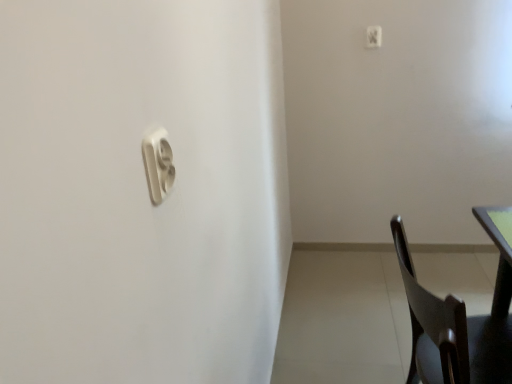
Locate an element on the screen. white plastic light switch at upper center, which is the first light switch from front to back is located at coordinates (x=158, y=165).

Identify the location of dark wood chair at lower right. This screenshot has height=384, width=512. (455, 329).

I want to click on table top below the white plastic light switch at upper center, which is the first light switch from front to back (from a real-world perspective), so click(495, 228).

Considering the positions of objects white plastic light switch at upper center, the first light switch positioned from the bottom, and green matte table top at right in the image provided, who is more to the left, white plastic light switch at upper center, the first light switch positioned from the bottom, or green matte table top at right?

Positioned to the left is white plastic light switch at upper center, the first light switch positioned from the bottom.

Between white plastic light switch at upper center, which appears as the second light switch when viewed from the right, and green matte table top at right, which one has smaller size?

With smaller size is white plastic light switch at upper center, which appears as the second light switch when viewed from the right.

Could you tell me if white plastic light switch at upper center, the 2th light switch positioned from the top, is turned towards green matte table top at right?

No, white plastic light switch at upper center, the 2th light switch positioned from the top, is not aimed at green matte table top at right.

Between white plastic light switch at upper right, which is counted as the first light switch, starting from the back, and dark wood chair at lower right, which one appears on the right side from the viewer's perspective?

dark wood chair at lower right.

From the image's perspective, between white plastic light switch at upper right, acting as the 2th light switch starting from the front, and dark wood chair at lower right, which one is located above?

white plastic light switch at upper right, acting as the 2th light switch starting from the front, appears higher in the image.

Considering their positions, is white plastic light switch at upper right, which ranks as the second light switch in left-to-right order, located in front of or behind dark wood chair at lower right?

Clearly, white plastic light switch at upper right, which ranks as the second light switch in left-to-right order, is behind dark wood chair at lower right.

Considering the sizes of white plastic light switch at upper right, which ranks as the second light switch in left-to-right order, and dark wood chair at lower right in the image, is white plastic light switch at upper right, which ranks as the second light switch in left-to-right order, taller or shorter than dark wood chair at lower right?

Clearly, white plastic light switch at upper right, which ranks as the second light switch in left-to-right order, is shorter compared to dark wood chair at lower right.

What's the angular difference between green matte table top at right and white plastic light switch at upper right, which ranks as the second light switch in left-to-right order,'s facing directions?

There is a 88.5-degree angle between the facing directions of green matte table top at right and white plastic light switch at upper right, which ranks as the second light switch in left-to-right order.

Is green matte table top at right positioned with its back to white plastic light switch at upper right, which appears as the 2th light switch when ordered from the bottom?

green matte table top at right does not have its back to white plastic light switch at upper right, which appears as the 2th light switch when ordered from the bottom.

Is point (493, 208) closer to camera compared to point (379, 34)?

No, (493, 208) is behind (379, 34).

Does green matte table top at right lie behind white plastic light switch at upper right, which ranks as the first light switch in right-to-left order?

No.

Is dark wood chair at lower right situated inside green matte table top at right or outside?

dark wood chair at lower right exists outside the volume of green matte table top at right.

Can you confirm if dark wood chair at lower right is wider than green matte table top at right?

Yes, dark wood chair at lower right is wider than green matte table top at right.

Can you confirm if dark wood chair at lower right is taller than green matte table top at right?

Indeed, dark wood chair at lower right has a greater height compared to green matte table top at right.

Does point (433, 298) appear closer or farther from the camera than point (509, 260)?

Point (433, 298) is positioned closer to the camera compared to point (509, 260).

From a real-world perspective, is green matte table top at right below white plastic light switch at upper center, which is the first light switch from front to back?

Indeed, from a real-world perspective, green matte table top at right is positioned beneath white plastic light switch at upper center, which is the first light switch from front to back.

Locate an element on the screen. table top behind the white plastic light switch at upper center, which is the 1th light switch in left-to-right order is located at coordinates (495, 228).

Does point (511, 251) appear closer or farther from the camera than point (163, 190)?

Point (511, 251).

From the image's perspective, between green matte table top at right and white plastic light switch at upper center, which appears as the second light switch when viewed from the right, which one is located above?

white plastic light switch at upper center, which appears as the second light switch when viewed from the right, is shown above in the image.

From a real-world perspective, is white plastic light switch at upper center, the first light switch positioned from the bottom, beneath dark wood chair at lower right?

Actually, white plastic light switch at upper center, the first light switch positioned from the bottom, is physically above dark wood chair at lower right in the real world.

Is the surface of white plastic light switch at upper center, which appears as the second light switch when viewed from the right, in direct contact with dark wood chair at lower right?

white plastic light switch at upper center, which appears as the second light switch when viewed from the right, and dark wood chair at lower right are not in contact.

Does white plastic light switch at upper center, which appears as the second light switch when viewed from the right, have a smaller size compared to dark wood chair at lower right?

Yes, white plastic light switch at upper center, which appears as the second light switch when viewed from the right, is smaller than dark wood chair at lower right.

Is white plastic light switch at upper center, which is the 1th light switch in left-to-right order, to the left or to the right of dark wood chair at lower right in the image?

Clearly, white plastic light switch at upper center, which is the 1th light switch in left-to-right order, is on the left of dark wood chair at lower right in the image.

From a real-world perspective, is dark wood chair at lower right physically located above or below white plastic light switch at upper center, which appears as the second light switch when viewed from the right?

dark wood chair at lower right is below white plastic light switch at upper center, which appears as the second light switch when viewed from the right.

Who is shorter, dark wood chair at lower right or white plastic light switch at upper center, the first light switch positioned from the bottom?

With less height is white plastic light switch at upper center, the first light switch positioned from the bottom.

Which of these two, dark wood chair at lower right or white plastic light switch at upper center, which appears as the second light switch when viewed from the right, is smaller?

Smaller between the two is white plastic light switch at upper center, which appears as the second light switch when viewed from the right.

Find the location of a particular element. The width and height of the screenshot is (512, 384). light switch in front of the green matte table top at right is located at coordinates (158, 165).

Locate an element on the screen. chair below the white plastic light switch at upper right, which appears as the 2th light switch when ordered from the bottom (from the image's perspective) is located at coordinates (455, 329).

Based on their spatial positions, is dark wood chair at lower right or green matte table top at right closer to white plastic light switch at upper right, which ranks as the first light switch in right-to-left order?

green matte table top at right.

In the scene shown: When comparing their distances from white plastic light switch at upper center, which is the 1th light switch in left-to-right order, does green matte table top at right or dark wood chair at lower right seem closer?

Based on the image, dark wood chair at lower right appears to be nearer to white plastic light switch at upper center, which is the 1th light switch in left-to-right order.

Estimate the real-world distances between objects in this image. Which object is further from dark wood chair at lower right, green matte table top at right or white plastic light switch at upper right, which is counted as the first light switch, starting from the back?

Based on the image, white plastic light switch at upper right, which is counted as the first light switch, starting from the back, appears to be further to dark wood chair at lower right.

Considering their positions, is green matte table top at right positioned closer to white plastic light switch at upper right, which ranks as the first light switch in right-to-left order, than white plastic light switch at upper center, the first light switch positioned from the bottom?

green matte table top at right lies closer to white plastic light switch at upper right, which ranks as the first light switch in right-to-left order, than the other object.

Which object lies further to the anchor point green matte table top at right, white plastic light switch at upper center, the 2th light switch positioned from the top, or dark wood chair at lower right?

Based on the image, white plastic light switch at upper center, the 2th light switch positioned from the top, appears to be further to green matte table top at right.

When comparing their distances from white plastic light switch at upper center, the 2th light switch positioned from the top, does white plastic light switch at upper right, which ranks as the first light switch in right-to-left order, or green matte table top at right seem further?

white plastic light switch at upper right, which ranks as the first light switch in right-to-left order.

From the image, which object appears to be farther from white plastic light switch at upper center, which appears as the second light switch when viewed from the right, dark wood chair at lower right or white plastic light switch at upper right, which ranks as the second light switch in left-to-right order?

The object further to white plastic light switch at upper center, which appears as the second light switch when viewed from the right, is white plastic light switch at upper right, which ranks as the second light switch in left-to-right order.

Which object lies further to the anchor point green matte table top at right, white plastic light switch at upper right, which appears as the 2th light switch when ordered from the bottom, or white plastic light switch at upper center, which appears as the second light switch when viewed from the right?

white plastic light switch at upper right, which appears as the 2th light switch when ordered from the bottom, lies further to green matte table top at right than the other object.

Image resolution: width=512 pixels, height=384 pixels. What are the coordinates of `chair between white plastic light switch at upper center, the 2th light switch positioned from the top, and white plastic light switch at upper right, which ranks as the second light switch in left-to-right order, along the z-axis` in the screenshot? It's located at (455, 329).

Locate an element on the screen. This screenshot has height=384, width=512. table top located between white plastic light switch at upper center, the first light switch positioned from the bottom, and white plastic light switch at upper right, which is counted as the first light switch, starting from the back, in the depth direction is located at coordinates click(495, 228).

This screenshot has height=384, width=512. Identify the location of chair between white plastic light switch at upper center, positioned as the 2th light switch in back-to-front order, and green matte table top at right, in the horizontal direction. (455, 329).

Find the location of `chair positioned between green matte table top at right and white plastic light switch at upper right, acting as the 2th light switch starting from the front, from near to far`. chair positioned between green matte table top at right and white plastic light switch at upper right, acting as the 2th light switch starting from the front, from near to far is located at coordinates (455, 329).